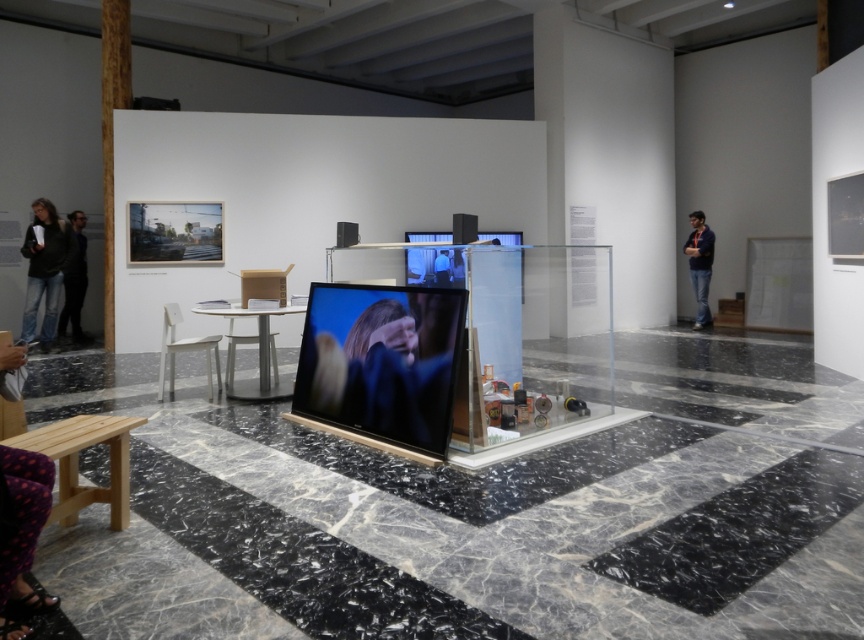
Question: Which object appears farthest from the camera in this image?

Choices:
 (A) dark blue jeans at left
 (B) blonde hair at center
 (C) smooth skin at center
 (D) dark blue shirt at right

Answer: (D)

Question: Does blonde hair at center have a larger size compared to smooth skin at center?

Choices:
 (A) yes
 (B) no

Answer: (A)

Question: Considering the real-world distances, which object is closest to the dark blue jeans at left?

Choices:
 (A) blonde hair at center
 (B) jeans at left
 (C) smooth skin at center
 (D) dark blue shirt at right

Answer: (B)

Question: Can you confirm if blonde hair at center is thinner than dark blue jeans at left?

Choices:
 (A) yes
 (B) no

Answer: (A)

Question: Which point is closer to the camera taking this photo?

Choices:
 (A) (442, 275)
 (B) (397, 348)

Answer: (B)

Question: Does jeans at left come behind dark blue shirt at right?

Choices:
 (A) yes
 (B) no

Answer: (B)